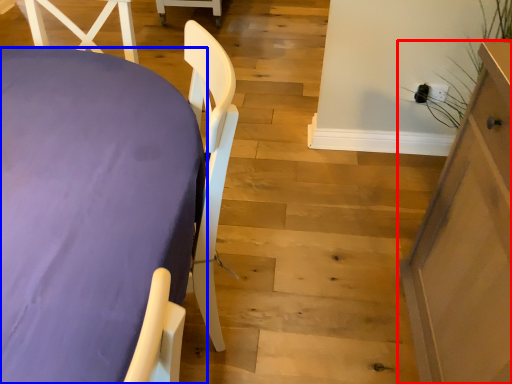
Question: Which object is further to the camera taking this photo, furniture (highlighted by a red box) or furniture (highlighted by a blue box)?

Choices:
 (A) furniture
 (B) furniture

Answer: (A)